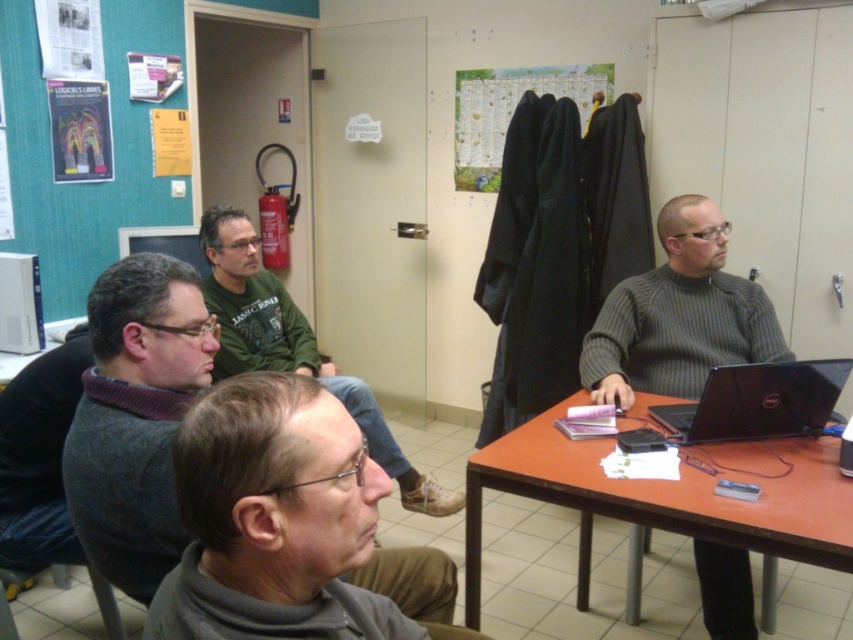
What is located at the coordinates point (679, 316)?

The gray ribbed sweater at center is located at point (679, 316).

You are organizing a meeting and need to place a laptop on the table. The white plastic computer at left is currently in use. Can you move it to the area where the paper map at center is located without overlapping?

The paper map at center is taller than the white plastic computer at left, so moving the white plastic computer at left to the area where the paper map at center is located would require more space. Since the paper map is already occupying that space and is larger, there might not be enough room. It might be better to find another spot on the table.

You are a delivery person who needs to place a 6.5 feet long package between the paper map at center and the white plastic computer at left. Can you fit it without moving either object?

The distance between the paper map at center and the white plastic computer at left is 7.10 feet. Since the package is 6.5 feet long, it can fit within the available space as 6.5 is less than 7.10.